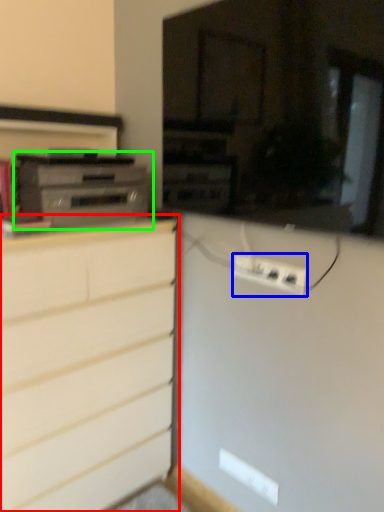
Question: Based on their relative distances, which object is nearer to chest of drawers (highlighted by a red box)? Choose from electric outlet (highlighted by a blue box) and home appliance (highlighted by a green box).

Choices:
 (A) electric outlet
 (B) home appliance

Answer: (B)